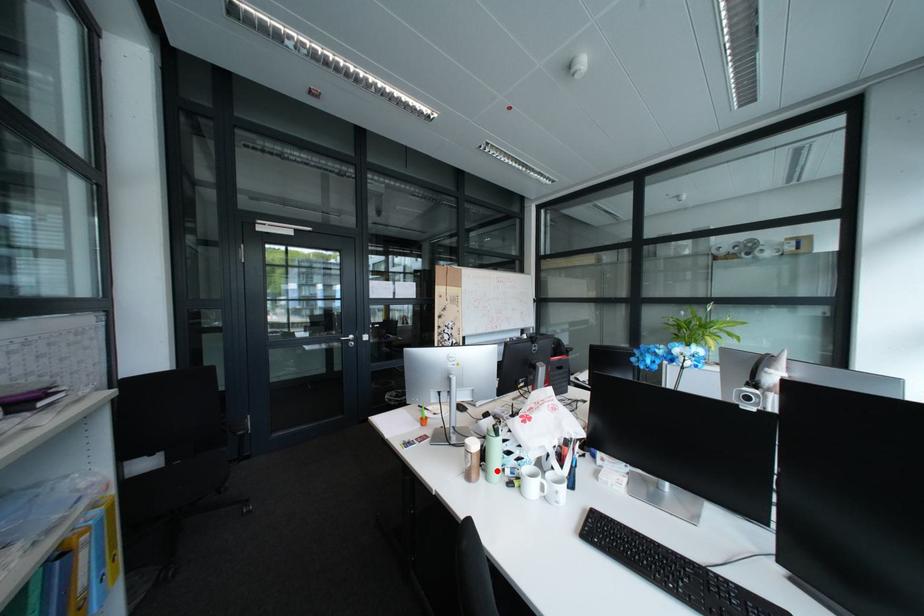
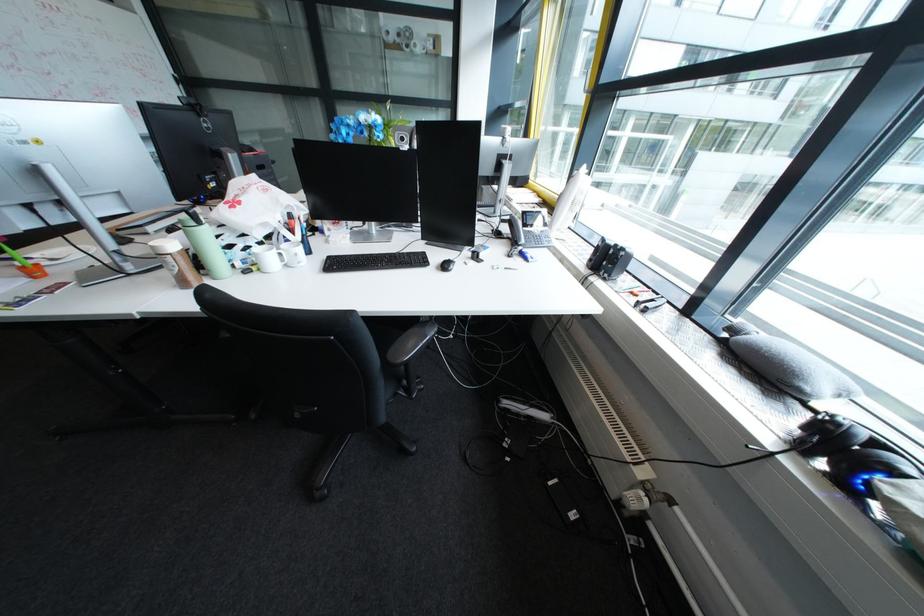
Locate, in the second image, the point that corresponds to the highlighted location in the first image.

(217, 275)